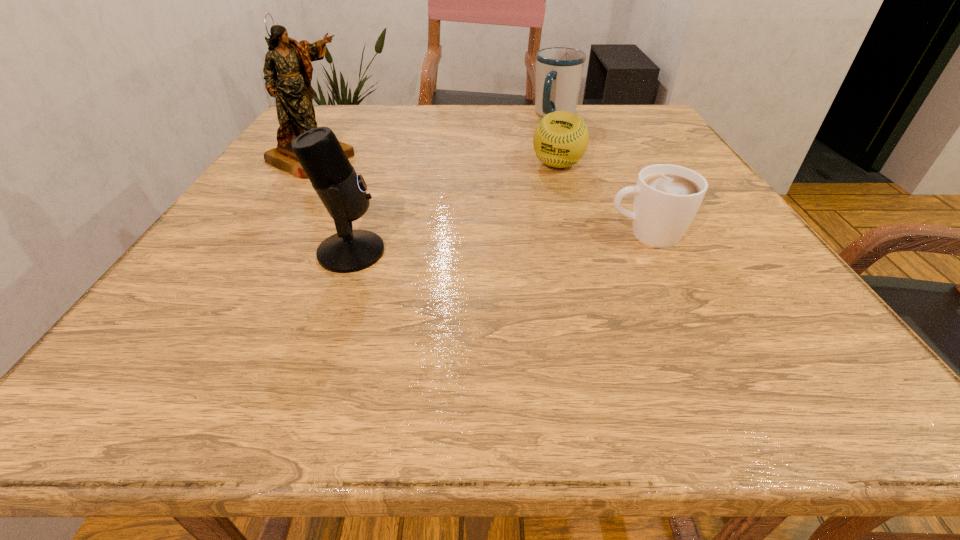
You are a GUI agent. You are given a task and a screenshot of the screen. Output one action in this format:
    pyautogui.click(x=<x>, y=<y>)
    Task: Click on the second object from left to right
    Image resolution: width=960 pixels, height=540 pixels.
    Given the screenshot: What is the action you would take?
    pyautogui.click(x=343, y=193)

Locate an element on the screen. microphone is located at coordinates (343, 193).

The height and width of the screenshot is (540, 960). In order to click on cappuccino in this screenshot , I will do `click(667, 197)`.

Locate an element on the screen. The image size is (960, 540). figurine is located at coordinates (291, 87).

Find the location of a particular element. the tallest object is located at coordinates (291, 87).

You are a GUI agent. You are given a task and a screenshot of the screen. Output one action in this format:
    pyautogui.click(x=<x>, y=<y>)
    Task: Click on the softball
    The width and height of the screenshot is (960, 540).
    Given the screenshot: What is the action you would take?
    pyautogui.click(x=560, y=140)

The width and height of the screenshot is (960, 540). Find the location of `mug`. mug is located at coordinates (559, 70).

Where is `the farthest object`? The height and width of the screenshot is (540, 960). the farthest object is located at coordinates (559, 70).

Locate an element on the screen. vacant space situated 0.110m on the stand of the fourth shortest object is located at coordinates coord(447,252).

You are a GUI agent. You are given a task and a screenshot of the screen. Output one action in this format:
    pyautogui.click(x=<x>, y=<y>)
    Task: Click on the free spot located 0.250m with the handle on the side of the cappuccino
    The height and width of the screenshot is (540, 960).
    Given the screenshot: What is the action you would take?
    pyautogui.click(x=469, y=234)